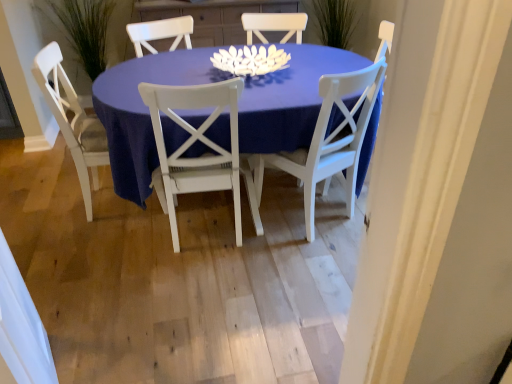
Question: Is white wood chair at left, which is counted as the third chair, starting from the right, taller than white wood chair at center, positioned as the 2th chair in right-to-left order?

Choices:
 (A) yes
 (B) no

Answer: (B)

Question: Can white wood chair at center, positioned as the 2th chair in right-to-left order, be found inside white wood chair at left, which is the first chair in left-to-right order?

Choices:
 (A) yes
 (B) no

Answer: (B)

Question: From the image's perspective, is white wood chair at left, which is the first chair in left-to-right order, on top of white wood chair at center, positioned as the 2th chair in right-to-left order?

Choices:
 (A) no
 (B) yes

Answer: (B)

Question: Is there a large distance between white wood chair at left, which is the first chair in left-to-right order, and white wood chair at center, positioned as the 2th chair in right-to-left order?

Choices:
 (A) yes
 (B) no

Answer: (B)

Question: Is white wood chair at left, which is the first chair in left-to-right order, bigger than white wood chair at center, positioned as the 2th chair in right-to-left order?

Choices:
 (A) yes
 (B) no

Answer: (A)

Question: Considering the positions of point (327, 125) and point (98, 9), is point (327, 125) closer or farther from the camera than point (98, 9)?

Choices:
 (A) closer
 (B) farther

Answer: (A)

Question: Considering the positions of white painted wood chair at center, positioned as the third chair in left-to-right order, and green grass at left in the image, is white painted wood chair at center, positioned as the third chair in left-to-right order, wider or thinner than green grass at left?

Choices:
 (A) thin
 (B) wide

Answer: (B)

Question: Considering the positions of white painted wood chair at center, the 1th chair in the right-to-left sequence, and green grass at left in the image, is white painted wood chair at center, the 1th chair in the right-to-left sequence, taller or shorter than green grass at left?

Choices:
 (A) tall
 (B) short

Answer: (A)

Question: From a real-world perspective, is white painted wood chair at center, positioned as the third chair in left-to-right order, above or below green grass at left?

Choices:
 (A) above
 (B) below

Answer: (B)

Question: Is matte white table at center in front of or behind white painted wood chair at center, positioned as the third chair in left-to-right order, in the image?

Choices:
 (A) behind
 (B) front

Answer: (B)

Question: Is matte white table at center spatially inside white painted wood chair at center, positioned as the third chair in left-to-right order, or outside of it?

Choices:
 (A) inside
 (B) outside

Answer: (B)

Question: From their relative heights in the image, would you say matte white table at center is taller or shorter than white painted wood chair at center, positioned as the third chair in left-to-right order?

Choices:
 (A) short
 (B) tall

Answer: (A)

Question: Is matte white table at center bigger or smaller than white painted wood chair at center, the 1th chair in the right-to-left sequence?

Choices:
 (A) small
 (B) big

Answer: (B)

Question: Is white painted wood chair at center, positioned as the third chair in left-to-right order, wider or thinner than white wood chair at left, which is the first chair in left-to-right order?

Choices:
 (A) thin
 (B) wide

Answer: (A)

Question: From their relative heights in the image, would you say white painted wood chair at center, the 1th chair in the right-to-left sequence, is taller or shorter than white wood chair at left, which is the first chair in left-to-right order?

Choices:
 (A) tall
 (B) short

Answer: (A)